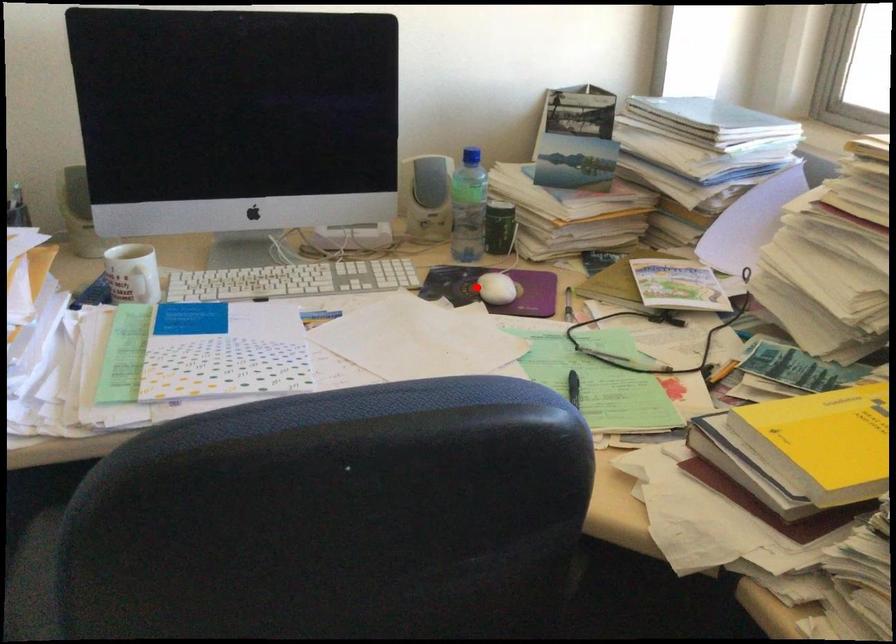
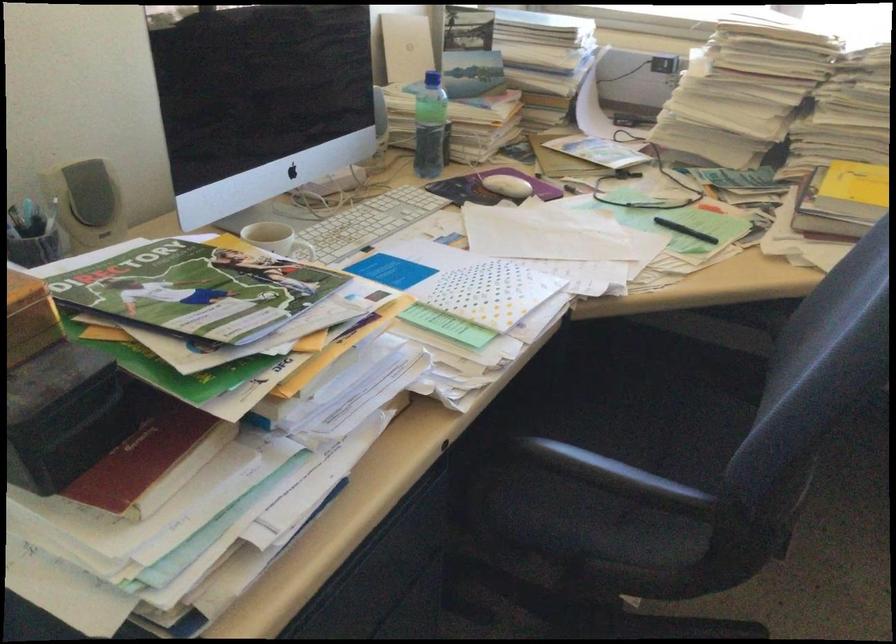
The point at the highlighted location is marked in the first image. Where is the corresponding point in the second image?

(506, 185)